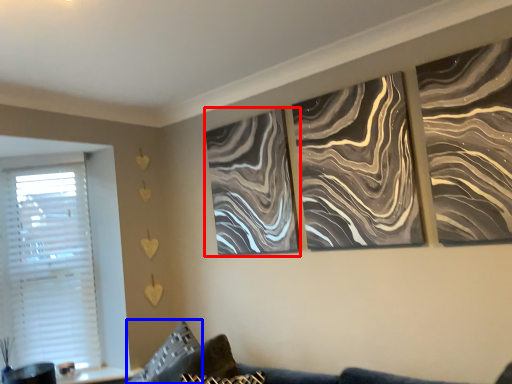
Question: Which object appears farthest to the camera in this image, canvas (highlighted by a red box) or pillow (highlighted by a blue box)?

Choices:
 (A) canvas
 (B) pillow

Answer: (A)